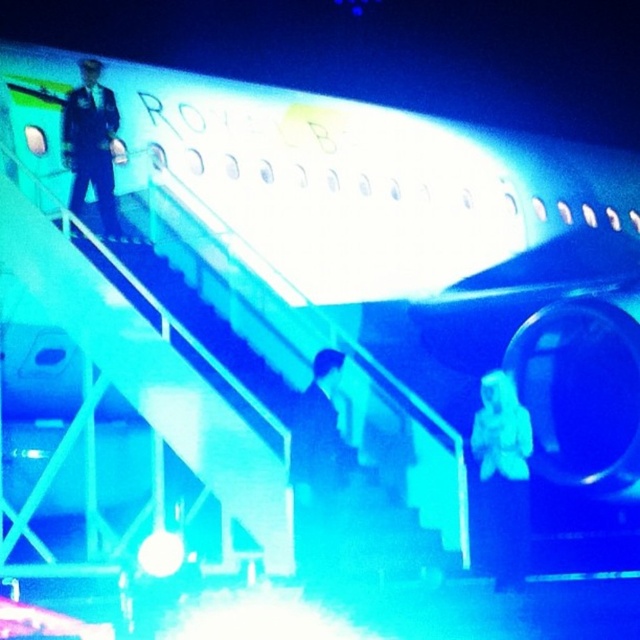
Question: Which point is closer to the camera taking this photo?

Choices:
 (A) (61, 124)
 (B) (339, 369)
 (C) (497, 497)

Answer: (B)

Question: Which object is the farthest from the dark blue suit at center?

Choices:
 (A) dark blue uniform at left
 (B) white matte suit at center

Answer: (A)

Question: Observing the image, what is the correct spatial positioning of dark blue uniform at left in reference to dark blue suit at center?

Choices:
 (A) right
 (B) left

Answer: (B)

Question: Does white matte suit at center appear over dark blue suit at center?

Choices:
 (A) yes
 (B) no

Answer: (B)

Question: Observing the image, what is the correct spatial positioning of dark blue uniform at left in reference to dark blue suit at center?

Choices:
 (A) right
 (B) left

Answer: (B)

Question: Which of the following is the farthest from the observer?

Choices:
 (A) (512, 579)
 (B) (324, 396)
 (C) (88, 141)

Answer: (C)